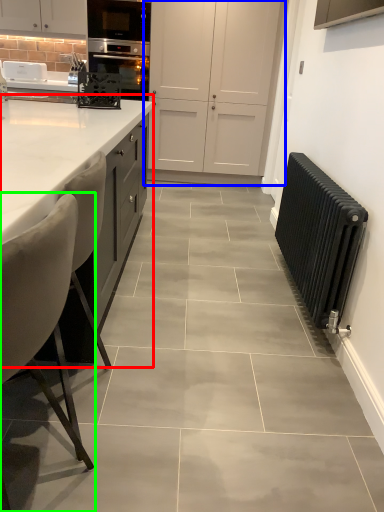
Question: Estimate the real-world distances between objects in this image. Which object is farther from countertop (highlighted by a red box), cabinetry (highlighted by a blue box) or chair (highlighted by a green box)?

Choices:
 (A) cabinetry
 (B) chair

Answer: (A)